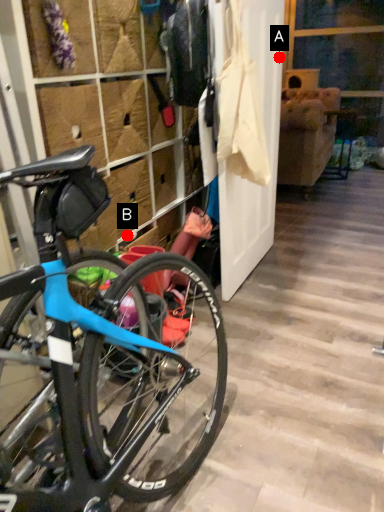
Question: Two points are circled on the image, labeled by A and B beside each circle. Which point is closer to the camera?

Choices:
 (A) A is closer
 (B) B is closer

Answer: (B)